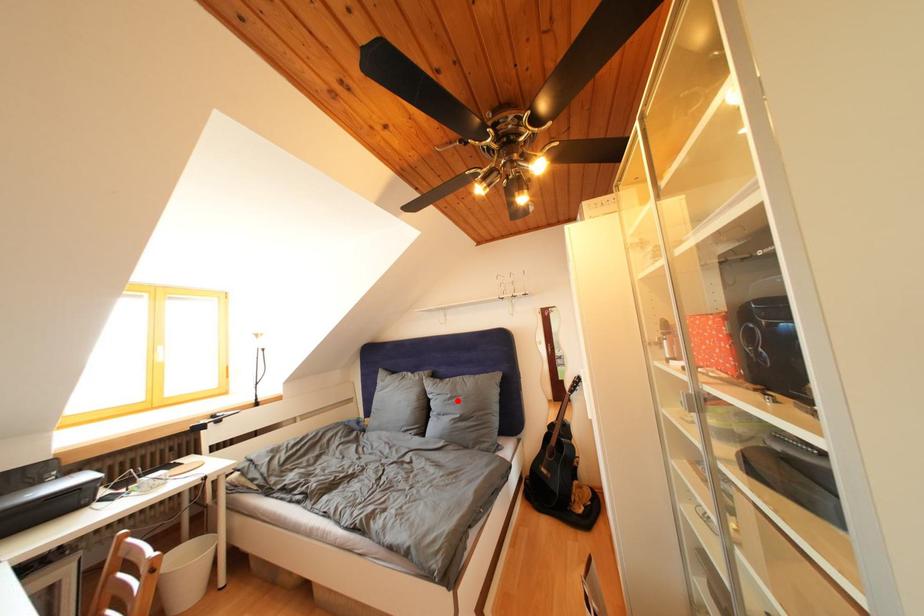
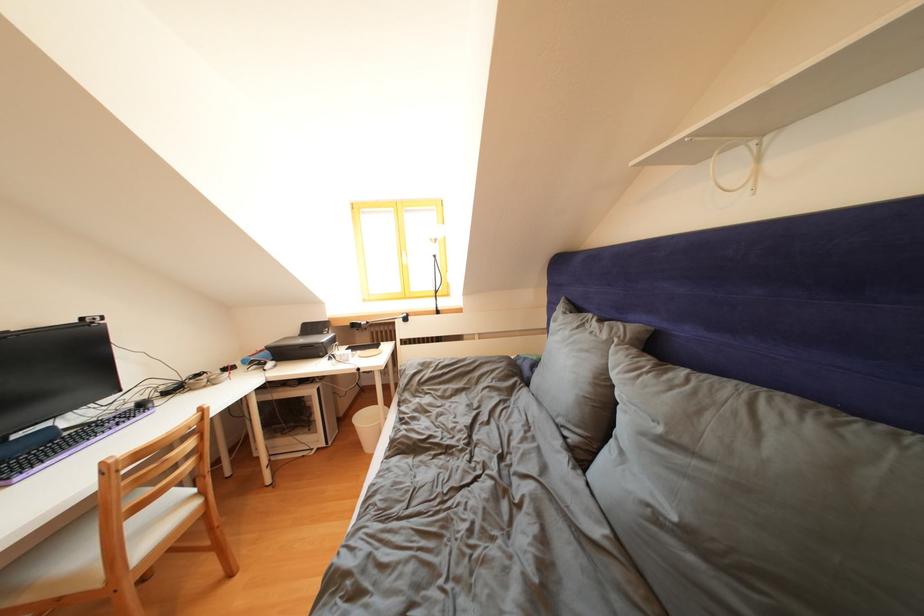
Question: I am providing you with two images of the same scene from different viewpoints. In image1, a red point is highlighted. Considering the same 3D point in image2, which of the following is correct?

Choices:
 (A) It is closer
 (B) It is farther

Answer: (A)